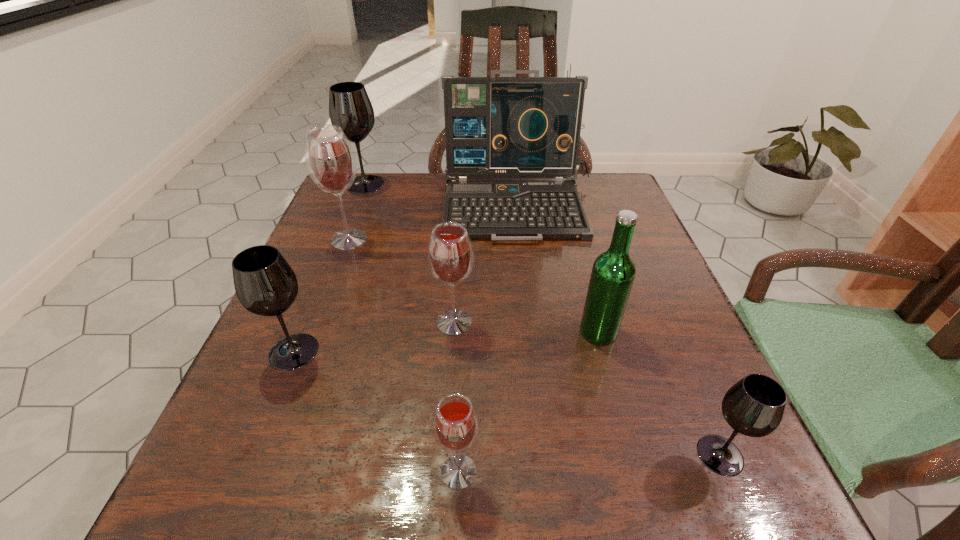
Identify the location of laptop computer. (495, 127).

At what (x,y) coordinates should I click in order to perform the action: click on the biggest gray wineglass. Please return your answer as a coordinate pair (x, y). This screenshot has height=540, width=960. Looking at the image, I should click on (350, 108).

The width and height of the screenshot is (960, 540). Find the location of `the farthest wineglass`. the farthest wineglass is located at coordinates (350, 108).

Where is `the biggest red wineglass`? the biggest red wineglass is located at coordinates (330, 159).

Find the location of a particular element. Image resolution: width=960 pixels, height=540 pixels. the farthest red wineglass is located at coordinates (330, 159).

The height and width of the screenshot is (540, 960). What are the coordinates of `beer bottle` in the screenshot? It's located at (613, 272).

Where is `the second farthest red wineglass`? This screenshot has width=960, height=540. the second farthest red wineglass is located at coordinates (450, 253).

What are the coordinates of `the second nearest gray wineglass` in the screenshot? It's located at (265, 284).

The image size is (960, 540). In order to click on the rightmost wineglass in this screenshot , I will do `click(754, 406)`.

This screenshot has height=540, width=960. Find the location of `the nearest gray wineglass`. the nearest gray wineglass is located at coordinates (754, 406).